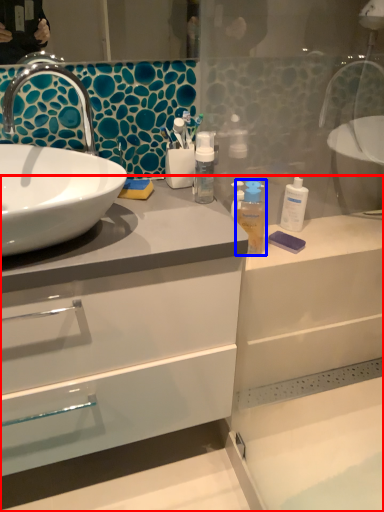
Question: Which object is closer to the camera taking this photo, bathroom cabinet (highlighted by a red box) or mouthwash (highlighted by a blue box)?

Choices:
 (A) bathroom cabinet
 (B) mouthwash

Answer: (A)